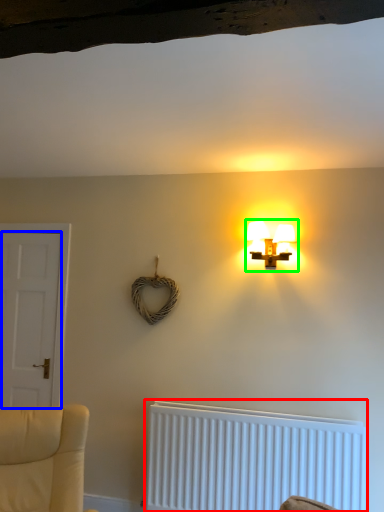
Question: Which object is positioned closest to radiator (highlighted by a red box)? Select from door (highlighted by a blue box) and lamp (highlighted by a green box).

Choices:
 (A) door
 (B) lamp

Answer: (B)